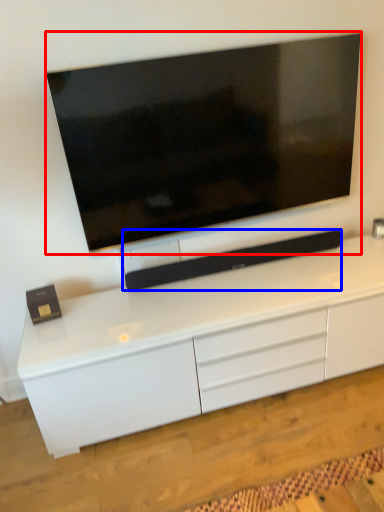
Question: Which object is closer to the camera taking this photo, television (highlighted by a red box) or equipment (highlighted by a blue box)?

Choices:
 (A) television
 (B) equipment

Answer: (A)